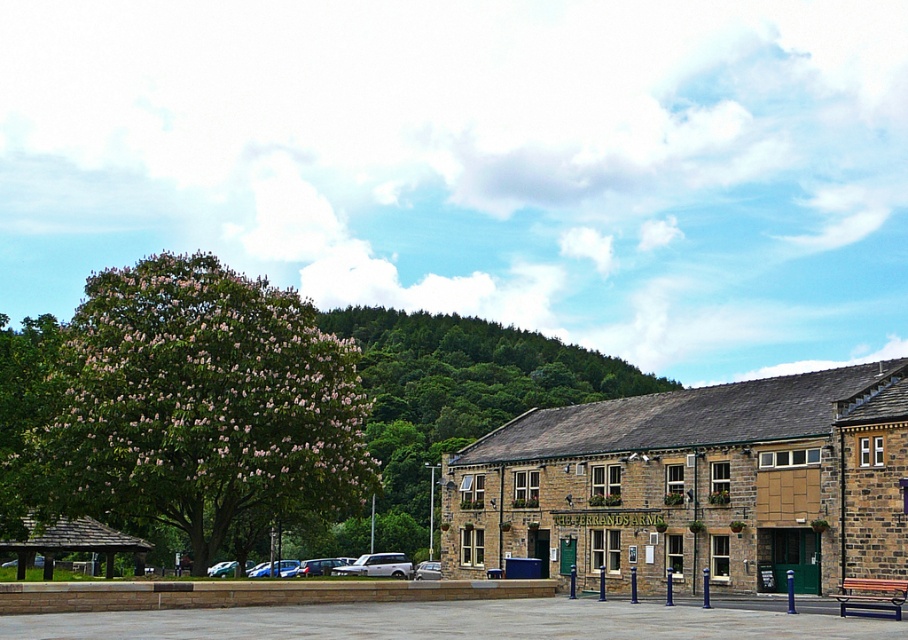
You are a delivery driver who needs to park your silver metallic van at center in a spot that allows easy access to the brown stone building at center. Based on their positions, can you park the van so that it is closer to the building?

The brown stone building at center is located above the silver metallic van at center, which means the van is positioned below the building. Since the van is already at the center and the building is above it, the van is as close as possible to the building in terms of vertical positioning. However, parking closer horizontally may depend on the available space in the parking area described in the scene.

You are standing in front of The Ferrands Arms and want to take a photo of the green leafy tree at left. If your camera can focus up to 50 meters, will you be able to capture a clear image of the tree?

The green leafy tree at left is 43.94 meters away from the viewer. Since the camera can focus up to 50 meters, it is within the focus range, so you can capture a clear image of the tree.

You are standing at the entrance of the brown stone building at center. If you walk straight ahead, will you immediately enter the paved parking area in front of the building?

Yes, because the paved parking area is directly in front of the brown stone building at center, so walking straight from the entrance would lead into it.